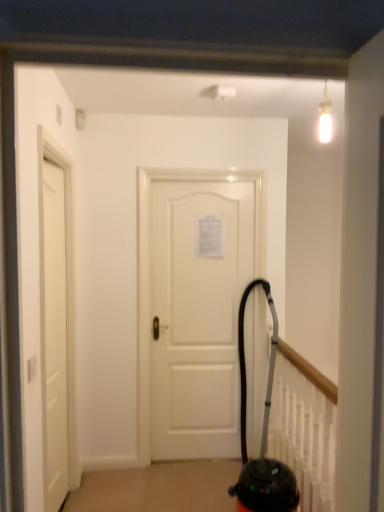
Question: Is white matte door at center, which is the second door in left-to-right order, facing towards white matte door at left, arranged as the first door when viewed from the front?

Choices:
 (A) yes
 (B) no

Answer: (B)

Question: Can you confirm if white matte door at center, the first door viewed from the back, is taller than white matte door at left, which is the second door from back to front?

Choices:
 (A) no
 (B) yes

Answer: (A)

Question: From the image's perspective, is white matte door at center, marked as the 2th door in a front-to-back arrangement, over white matte door at left, arranged as the first door when viewed from the front?

Choices:
 (A) yes
 (B) no

Answer: (A)

Question: Considering the relative sizes of white matte door at center, acting as the first door starting from the right, and white matte door at left, arranged as the first door when viewed from the front, in the image provided, is white matte door at center, acting as the first door starting from the right, wider than white matte door at left, arranged as the first door when viewed from the front,?

Choices:
 (A) no
 (B) yes

Answer: (A)

Question: Is white matte door at center, the first door viewed from the back, located outside white matte door at left, which is the second door from back to front?

Choices:
 (A) no
 (B) yes

Answer: (B)

Question: Can you confirm if white matte door at center, which is the second door in left-to-right order, is thinner than white matte door at left, which is counted as the 1th door, starting from the left?

Choices:
 (A) yes
 (B) no

Answer: (A)

Question: From the image's perspective, would you say white matte door at left, arranged as the first door when viewed from the front, is positioned over white matte door at center, which is the second door in left-to-right order?

Choices:
 (A) no
 (B) yes

Answer: (A)

Question: From the image's perspective, is white matte door at left, which is counted as the 1th door, starting from the left, under white matte door at center, acting as the first door starting from the right?

Choices:
 (A) yes
 (B) no

Answer: (A)

Question: Is white matte door at left, arranged as the first door when viewed from the front, smaller than white matte door at center, the first door viewed from the back?

Choices:
 (A) no
 (B) yes

Answer: (A)

Question: Is there a large distance between white matte door at left, which is the second door from back to front, and white matte door at center, the first door viewed from the back?

Choices:
 (A) no
 (B) yes

Answer: (A)

Question: Does white matte door at left, the second door from the right, have a lesser width compared to white matte door at center, which is the second door in left-to-right order?

Choices:
 (A) yes
 (B) no

Answer: (B)

Question: Is white matte door at left, arranged as the first door when viewed from the front, completely or partially outside of white matte door at center, acting as the first door starting from the right?

Choices:
 (A) yes
 (B) no

Answer: (A)

Question: Is white matte door at center, which is the second door in left-to-right order, in contact with black rubber vacuum cleaner at center?

Choices:
 (A) no
 (B) yes

Answer: (A)